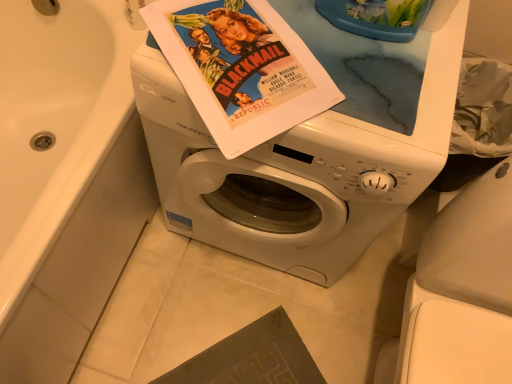
Question: Is point (241, 81) closer or farther from the camera than point (49, 249)?

Choices:
 (A) farther
 (B) closer

Answer: (B)

Question: Which is correct: matte paper movie poster at center is inside white glossy bathtub at upper left, or outside of it?

Choices:
 (A) inside
 (B) outside

Answer: (B)

Question: Which object is positioned closest to the white glossy bathtub at upper left?

Choices:
 (A) matte paper movie poster at center
 (B) white glossy washing machine at center

Answer: (B)

Question: Estimate the real-world distances between objects in this image. Which object is closer to the matte paper movie poster at center?

Choices:
 (A) white glossy washing machine at center
 (B) white glossy bathtub at upper left

Answer: (A)